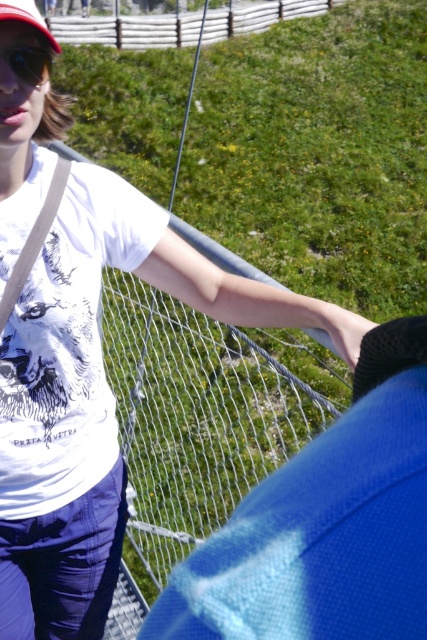
You are a photographer trying to capture a closeup of the person in the scene. You need to know the position of the matte black goggles at upper left and the matte red baseball cap at upper left relative to each other to frame the shot properly. Which object is positioned to the right?

The matte black goggles at upper left is to the right of the matte red baseball cap at upper left, so the matte black goggles at upper left is positioned to the right.

You are a fashion designer analyzing the accessories in the scene. Which accessory has a smaller width between the matte black goggles at upper left and the matte red baseball cap at upper left?

The matte black goggles at upper left has a smaller width than the matte red baseball cap at upper left.

In the scene shown: You are a photographer trying to capture the matte black goggles at upper left in the scene. Based on their position, where should you aim your camera to ensure they are centered in the frame?

The matte black goggles at upper left are located at coordinates point [28,64], so you should aim your camera at that point to center them in the frame.